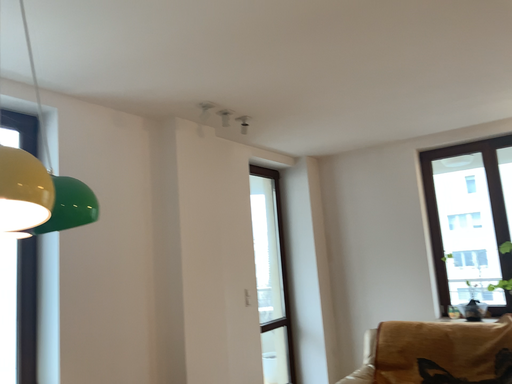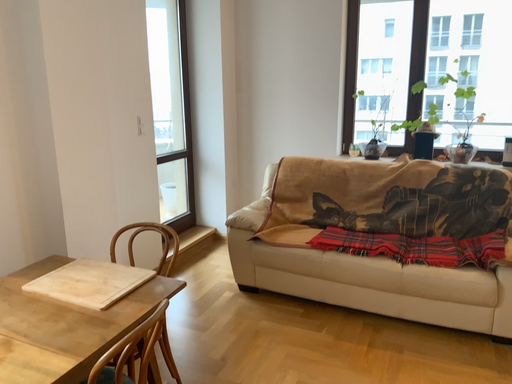
Question: Which way did the camera rotate in the video?

Choices:
 (A) rotated right
 (B) rotated left

Answer: (A)